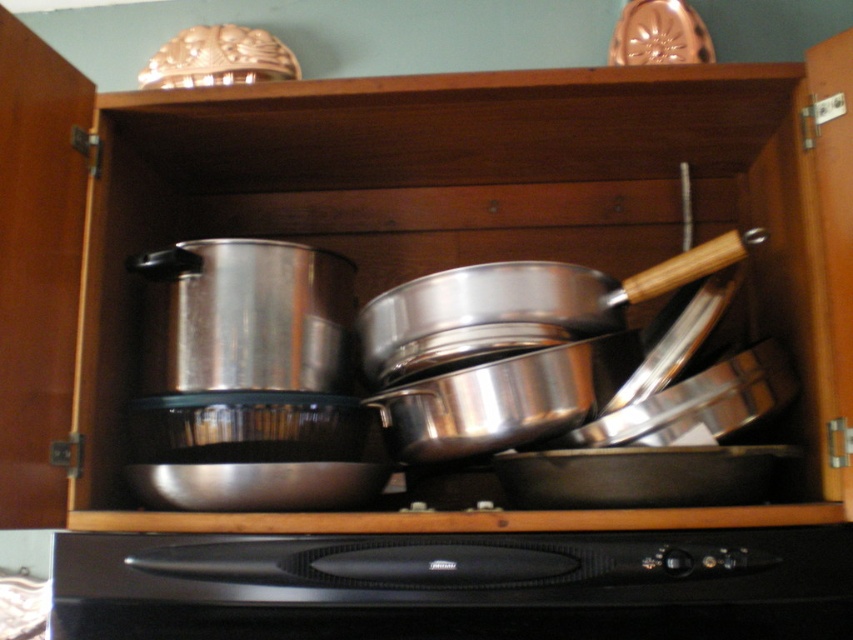
Question: Which point is closer to the camera taking this photo?

Choices:
 (A) coord(526,593)
 (B) coord(531,296)

Answer: (A)

Question: Is black matte oven at bottom positioned behind shiny silver frying pan at center?

Choices:
 (A) yes
 (B) no

Answer: (B)

Question: Can you confirm if black matte oven at bottom is wider than shiny silver frying pan at center?

Choices:
 (A) yes
 (B) no

Answer: (A)

Question: Does black matte oven at bottom appear on the left side of shiny silver frying pan at center?

Choices:
 (A) yes
 (B) no

Answer: (A)